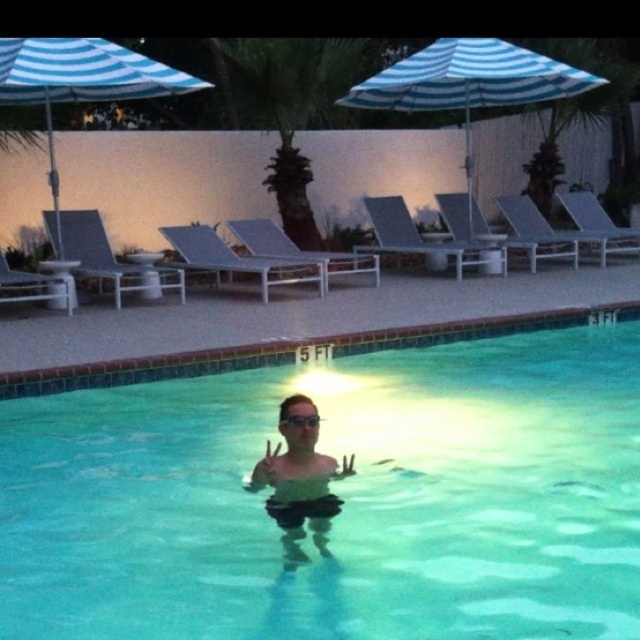
You are a lifeguard who needs to ensure that the transparent plastic goggles at center are visible to swimmers from the blue striped umbrella at upper center. Given their sizes, will the goggles be easily noticeable from under the umbrella?

The blue striped umbrella at upper center is wider than the transparent plastic goggles at center, so the goggles might be less noticeable due to the umbrella being larger in size.

You are planning to take a photo of the clear glass water at center and the blue striped umbrella at upper center. Which object should you focus on first if you want to capture both in a single shot without moving the camera?

Since the clear glass water at center has a larger size compared to the blue striped umbrella at upper center, you should focus on the clear glass water at center first to ensure it is sharp and in focus, then adjust exposure for the umbrella.

You are a swimmer who wants to retrieve your transparent plastic goggles at center from the pool. You notice a blue striped umbrella at upper left nearby. Which object is closer to you as you swim towards them?

The blue striped umbrella at upper left is closer to you than the transparent plastic goggles at center because the goggles are behind the umbrella.